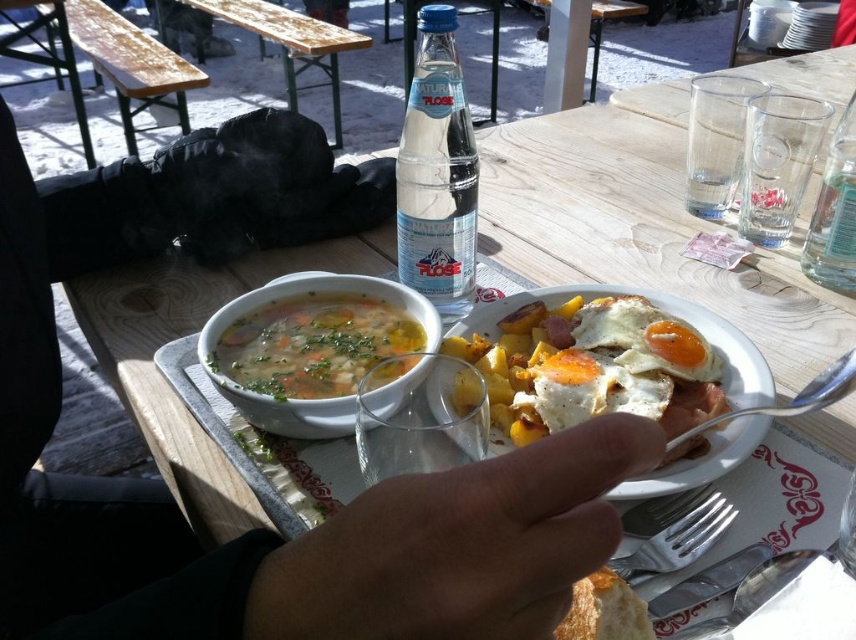
Who is lower down, clear glass bottle at center or shiny metal fork at lower right?

shiny metal fork at lower right

Can you confirm if clear glass bottle at center is wider than shiny metal fork at lower right?

No.

Is point (409, 253) closer to camera compared to point (685, 637)?

No, (409, 253) is further to viewer.

This screenshot has height=640, width=856. In order to click on clear glass bottle at center in this screenshot , I will do `click(437, 173)`.

Can you confirm if black fabric jacket at upper left is shorter than clear glass bottle at center?

No.

Where is `black fabric jacket at upper left`? The height and width of the screenshot is (640, 856). black fabric jacket at upper left is located at coordinates (265, 529).

At what (x,y) coordinates should I click in order to perform the action: click on black fabric jacket at upper left. Please return your answer as a coordinate pair (x, y). Image resolution: width=856 pixels, height=640 pixels. Looking at the image, I should click on (265, 529).

Does white ceramic bowl at center have a lesser width compared to shiny metallic fork at lower right?

No, white ceramic bowl at center is not thinner than shiny metallic fork at lower right.

Which is behind, point (355, 349) or point (745, 547)?

The point (355, 349) is behind.

I want to click on white ceramic bowl at center, so click(305, 349).